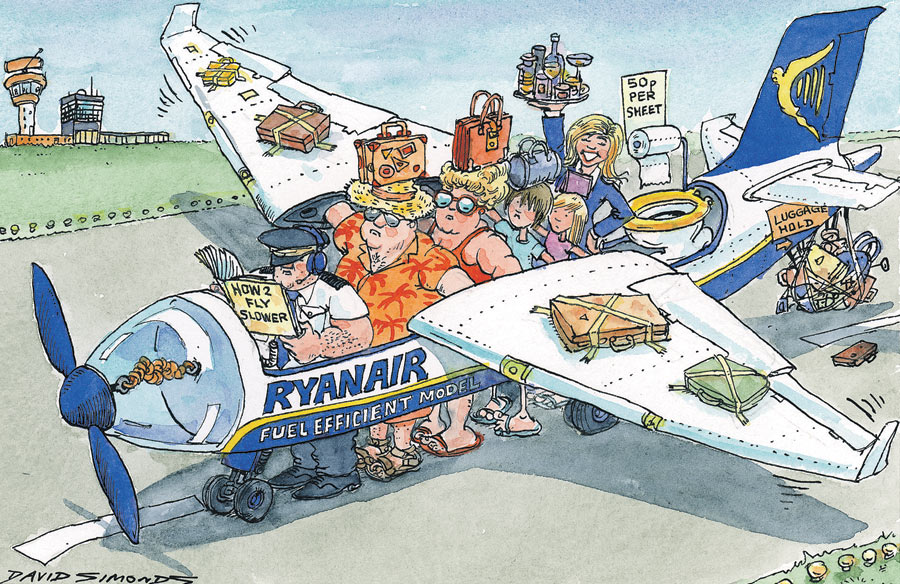
Find the location of a particular element. Image resolution: width=900 pixels, height=584 pixels. book is located at coordinates (266, 293).